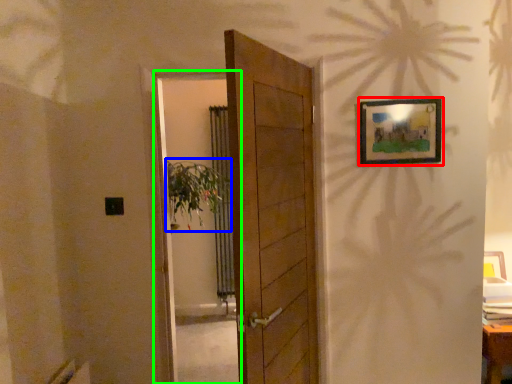
Question: Which object is positioned farthest from picture frame (highlighted by a red box)? Select from plant (highlighted by a blue box) and screen door (highlighted by a green box).

Choices:
 (A) plant
 (B) screen door

Answer: (B)